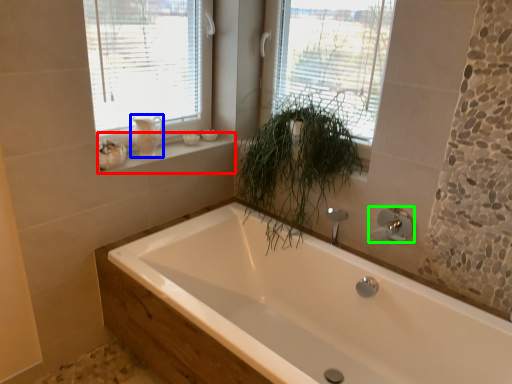
Question: Which object is the closest to the window sill (highlighted by a red box)? Choose among these: gray (highlighted by a blue box) or tap (highlighted by a green box).

Choices:
 (A) gray
 (B) tap

Answer: (A)